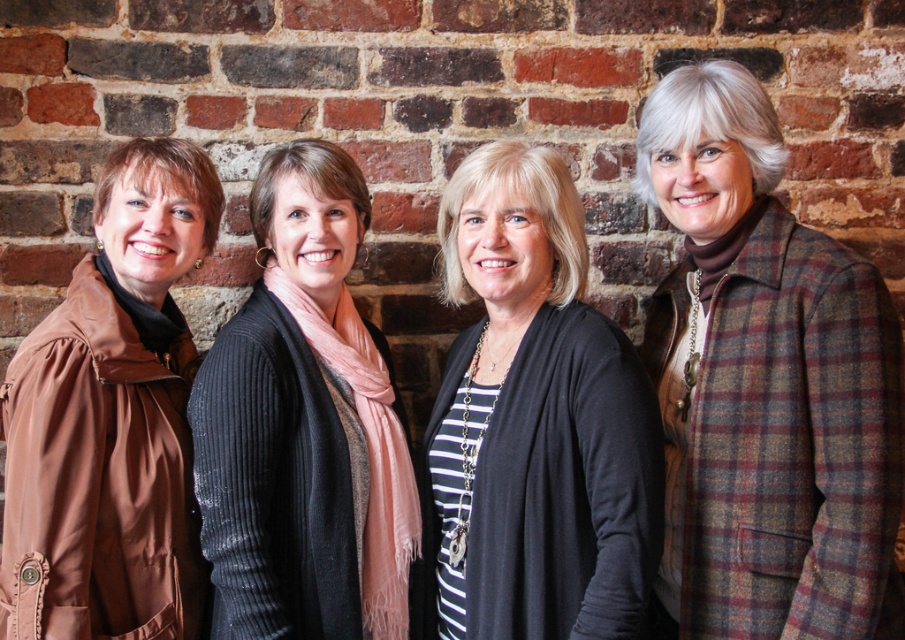
You are a fashion stylist trying to fit a new dress into a display case. The case has two sections. The left section is narrower than the right. You have two garments to place in the case. The plaid wool coat at right and the black knit cardigan at center. Which garment should go in the narrower section?

The plaid wool coat at right should go in the narrower section because its width is less than the black knit cardigan at center.

You need to decide which coat to take for a narrow hallway. You see the plaid wool coat at right and the brown leather jacket at left in the image. Which one is more likely to fit through the narrow hallway without getting stuck?

The brown leather jacket at left is narrower than the plaid wool coat at right, so it is more likely to fit through the narrow hallway without getting stuck.